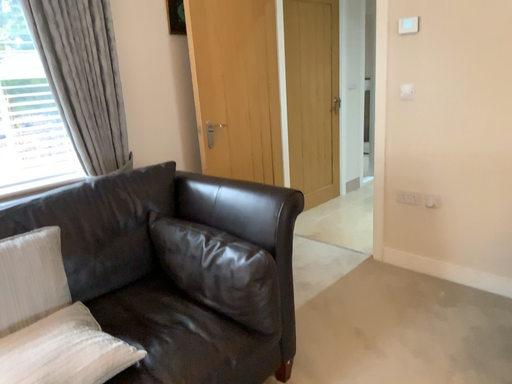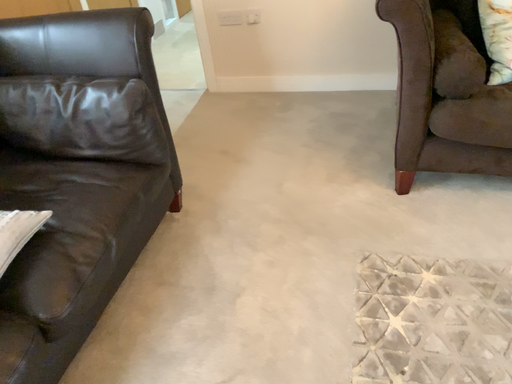
Question: Which way did the camera rotate in the video?

Choices:
 (A) rotated downward
 (B) rotated upward

Answer: (A)